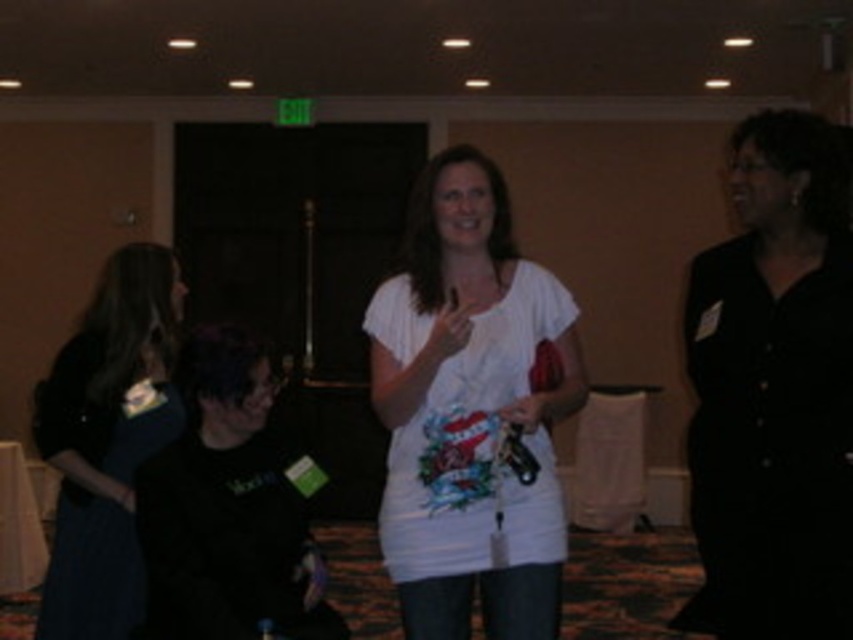
Question: Is black satin dress at right bigger than dark blue dress at left?

Choices:
 (A) no
 (B) yes

Answer: (A)

Question: Which object is farther from the camera taking this photo?

Choices:
 (A) black satin dress at right
 (B) white cotton t-shirt at center
 (C) dark blue dress at left

Answer: (C)

Question: Can you confirm if white cotton t-shirt at center is positioned below dark blue dress at left?

Choices:
 (A) no
 (B) yes

Answer: (A)

Question: Is black satin dress at right above dark blue dress at left?

Choices:
 (A) yes
 (B) no

Answer: (A)

Question: Which point is closer to the camera taking this photo?

Choices:
 (A) (780, 452)
 (B) (523, 262)
 (C) (99, 516)

Answer: (A)

Question: Which point is farther to the camera?

Choices:
 (A) dark blue dress at left
 (B) white cotton t-shirt at center
 (C) black satin dress at right

Answer: (A)